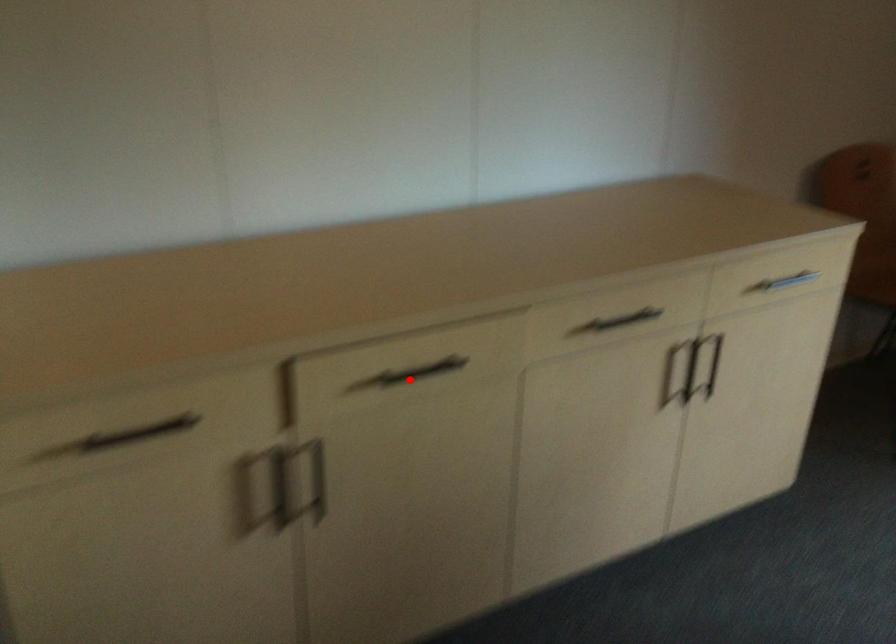
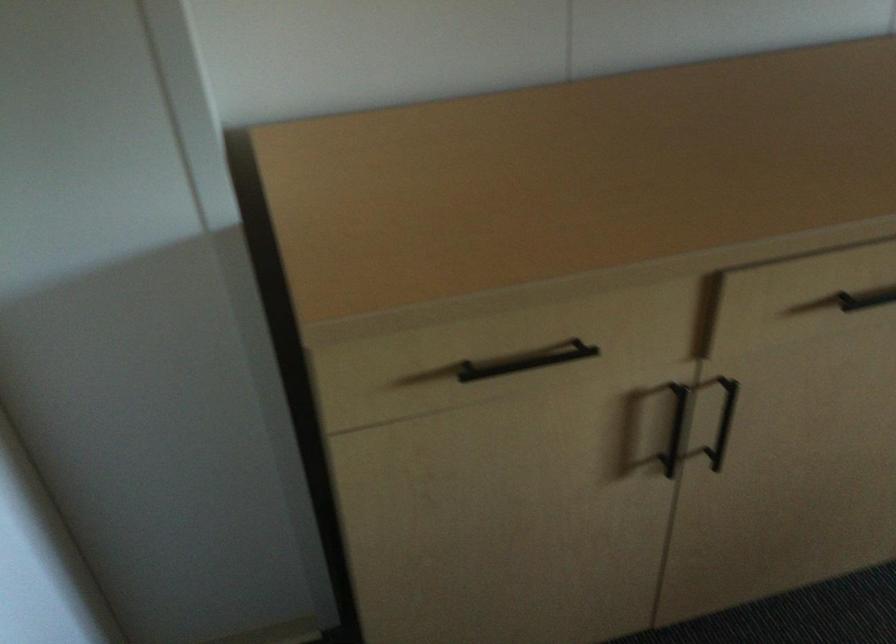
In the second image, find the point that corresponds to the highlighted location in the first image.

(866, 299)